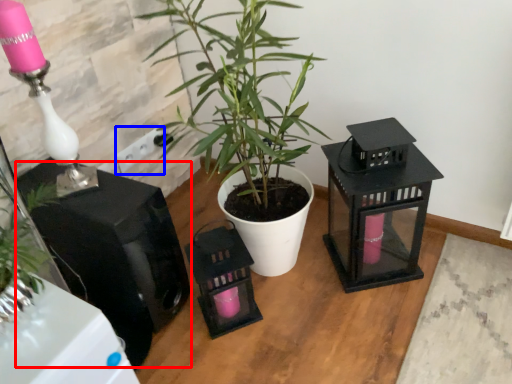
Question: Which of the following is the closest to the observer, appliance (highlighted by a red box) or electric outlet (highlighted by a blue box)?

Choices:
 (A) appliance
 (B) electric outlet

Answer: (A)